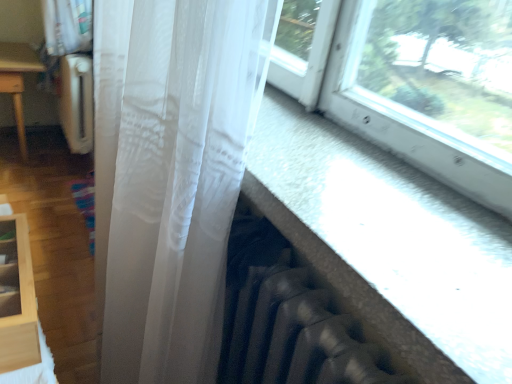
Question: Is light wood shelf at lower left in contact with translucent white curtain at center?

Choices:
 (A) no
 (B) yes

Answer: (A)

Question: Considering the relative positions of light wood shelf at lower left and translucent white curtain at center in the image provided, is light wood shelf at lower left behind translucent white curtain at center?

Choices:
 (A) no
 (B) yes

Answer: (B)

Question: Does light wood shelf at lower left have a greater width compared to translucent white curtain at center?

Choices:
 (A) yes
 (B) no

Answer: (B)

Question: Is light wood shelf at lower left to the right of translucent white curtain at center from the viewer's perspective?

Choices:
 (A) yes
 (B) no

Answer: (B)

Question: Is translucent white curtain at center surrounded by light wood shelf at lower left?

Choices:
 (A) no
 (B) yes

Answer: (A)

Question: From a real-world perspective, is light wood shelf at lower left beneath translucent white curtain at center?

Choices:
 (A) no
 (B) yes

Answer: (A)

Question: Does translucent white curtain at center have a lesser height compared to light wood shelf at lower left?

Choices:
 (A) no
 (B) yes

Answer: (A)

Question: Can you confirm if translucent white curtain at center is positioned to the left of light wood shelf at lower left?

Choices:
 (A) no
 (B) yes

Answer: (A)

Question: From a real-world perspective, is translucent white curtain at center physically below light wood shelf at lower left?

Choices:
 (A) yes
 (B) no

Answer: (A)

Question: Is translucent white curtain at center aimed at light wood shelf at lower left?

Choices:
 (A) yes
 (B) no

Answer: (A)

Question: Considering the relative sizes of translucent white curtain at center and light wood shelf at lower left in the image provided, is translucent white curtain at center taller than light wood shelf at lower left?

Choices:
 (A) yes
 (B) no

Answer: (A)

Question: Is translucent white curtain at center wider than light wood shelf at lower left?

Choices:
 (A) yes
 (B) no

Answer: (A)

Question: Is translucent white curtain at center positioned in front of transparent fabric at lower right?

Choices:
 (A) yes
 (B) no

Answer: (B)